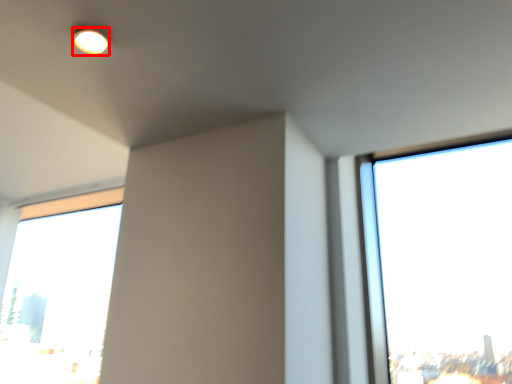
Question: From the image's perspective, considering the relative positions of lighting (annotated by the red box) and window in the image provided, where is lighting (annotated by the red box) located with respect to the staircase?

Choices:
 (A) below
 (B) above

Answer: (B)